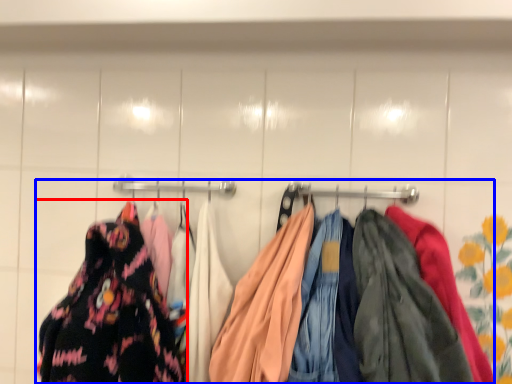
Question: Among these objects, which one is farthest to the camera, fancy dress (highlighted by a red box) or laundry (highlighted by a blue box)?

Choices:
 (A) fancy dress
 (B) laundry

Answer: (A)